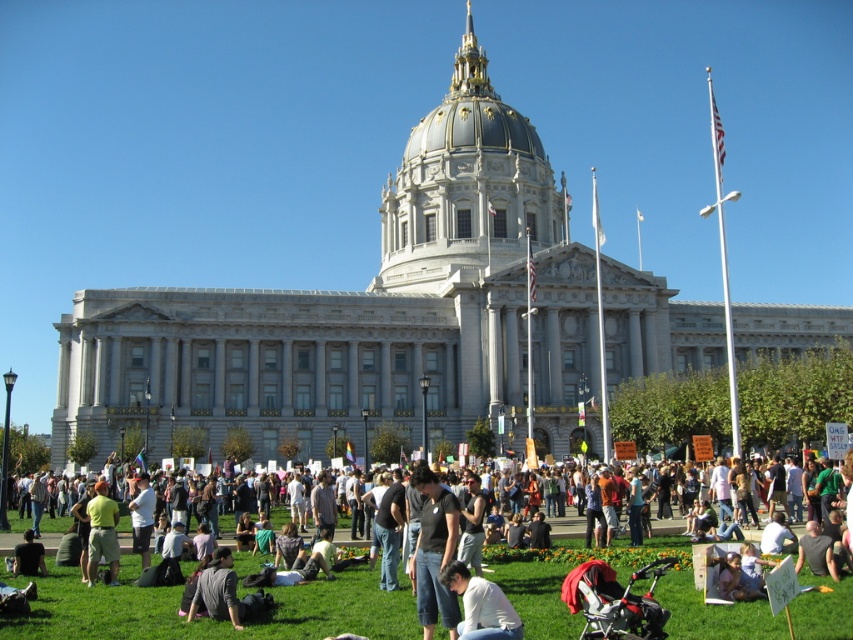
Question: Does dark gray cotton shirt at center have a larger size compared to gray cotton shirt at lower center?

Choices:
 (A) yes
 (B) no

Answer: (A)

Question: Which object appears farthest from the camera in this image?

Choices:
 (A) gray cotton shirt at lower center
 (B) dark gray cotton shirt at center

Answer: (A)

Question: Does dark gray jeans at center appear on the left side of dark gray cotton shirt at center?

Choices:
 (A) no
 (B) yes

Answer: (B)

Question: Which of the following is the closest to the observer?

Choices:
 (A) (444, 545)
 (B) (241, 616)
 (C) (26, 545)
 (D) (469, 611)

Answer: (D)

Question: Is dark gray cotton shirt at center to the left of denim jeans at lower center from the viewer's perspective?

Choices:
 (A) no
 (B) yes

Answer: (B)

Question: Which of the following is the farthest from the observer?

Choices:
 (A) gray cotton shirt at lower center
 (B) dark gray cotton shirt at center

Answer: (A)